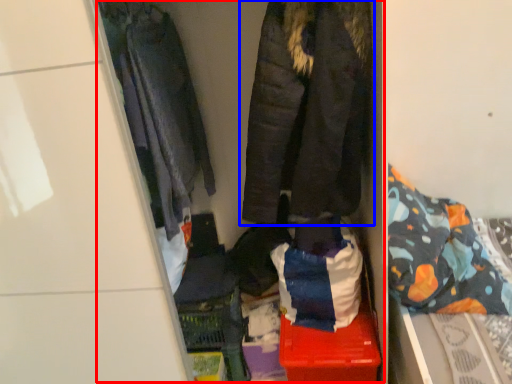
Question: Which object appears closest to the camera in this image, closet (highlighted by a red box) or jacket (highlighted by a blue box)?

Choices:
 (A) closet
 (B) jacket

Answer: (A)